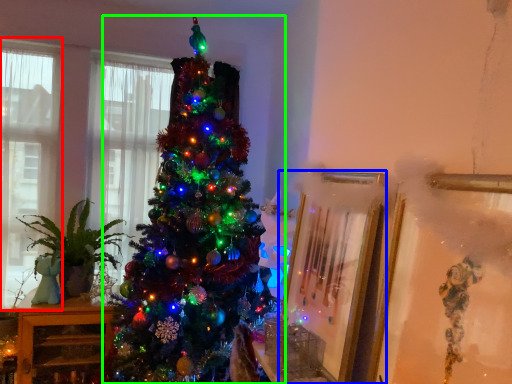
Question: Considering the real-world distances, which object is farthest from window (highlighted by a red box)? picture frame (highlighted by a blue box) or christmas tree (highlighted by a green box)?

Choices:
 (A) picture frame
 (B) christmas tree

Answer: (A)